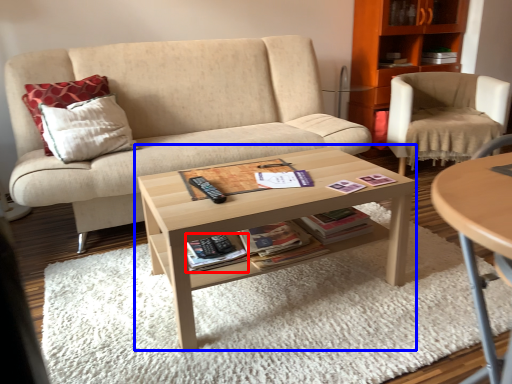
Question: Which of the following is the farthest to the observer, paperback book (highlighted by a red box) or coffee table (highlighted by a blue box)?

Choices:
 (A) paperback book
 (B) coffee table

Answer: (A)